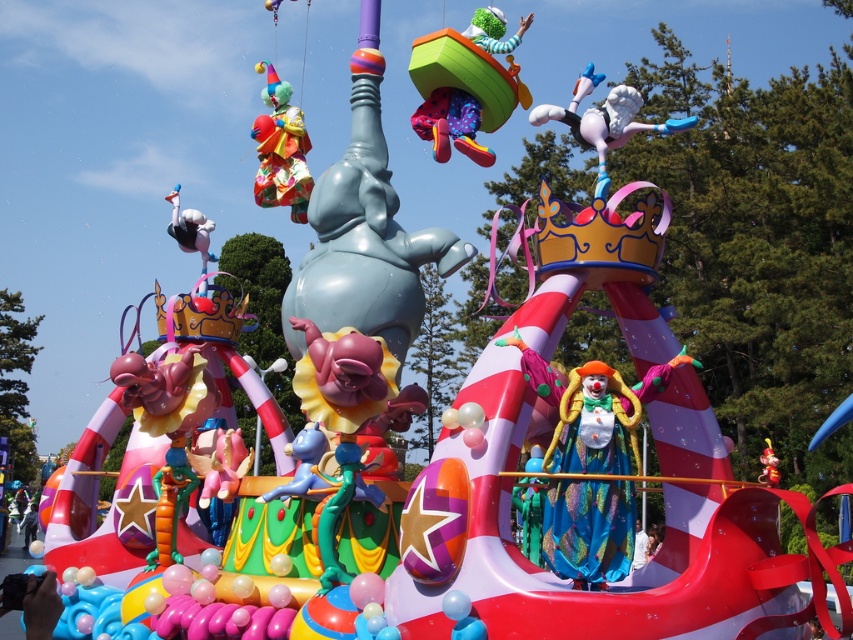
Looking at the vibrant parade float, there is a multicolored fabric clown at center and a matte green plastic boat at upper center. Which object is positioned to the right side of the other?

The multicolored fabric clown at center is to the right of the matte green plastic boat at upper center.

You are a child standing in front of the parade float and you see the shiny red toy at center and the matte blue clown at center. Which object is closer to you?

The shiny red toy at center is closer to you because it is in front of the matte blue clown at center.